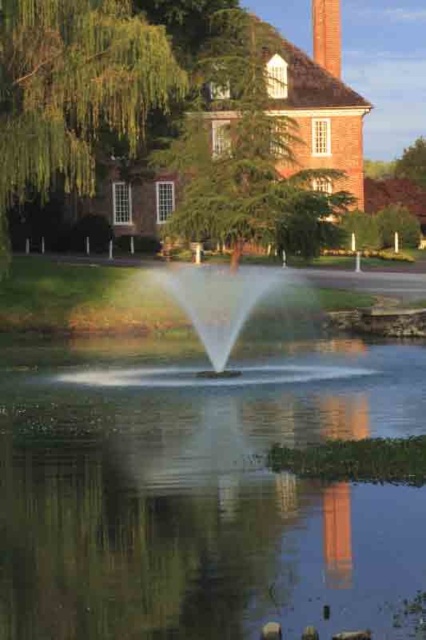
Question: Which object is farther from the camera taking this photo?

Choices:
 (A) red brick chimney at upper center
 (B) green leafy tree at upper center
 (C) green leafy tree at upper left

Answer: (A)

Question: Does clear water at center have a greater width compared to red brick chimney at upper center?

Choices:
 (A) yes
 (B) no

Answer: (A)

Question: Which point is closer to the camera?

Choices:
 (A) (238, 116)
 (B) (328, 32)
 (C) (62, 52)
 (D) (256, 602)

Answer: (D)

Question: Which point appears farthest from the camera in this image?

Choices:
 (A) (46, 380)
 (B) (319, 65)
 (C) (198, 157)

Answer: (B)

Question: Does green leafy tree at upper center have a larger size compared to red brick chimney at upper center?

Choices:
 (A) yes
 (B) no

Answer: (B)

Question: Is green leafy tree at upper center positioned at the back of green leafy tree at upper left?

Choices:
 (A) no
 (B) yes

Answer: (B)